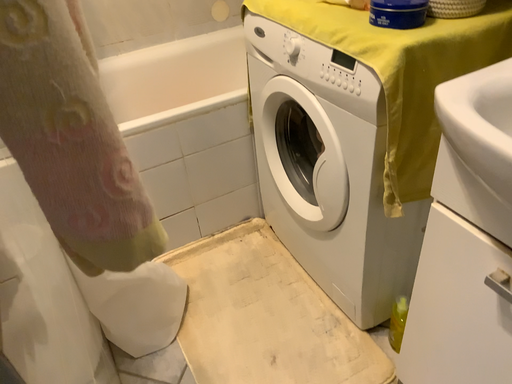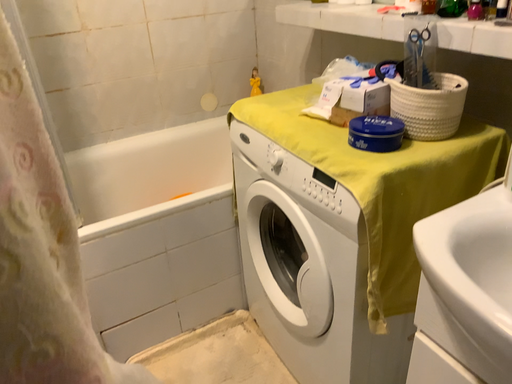
Question: Which way did the camera rotate in the video?

Choices:
 (A) rotated upward
 (B) rotated downward

Answer: (A)